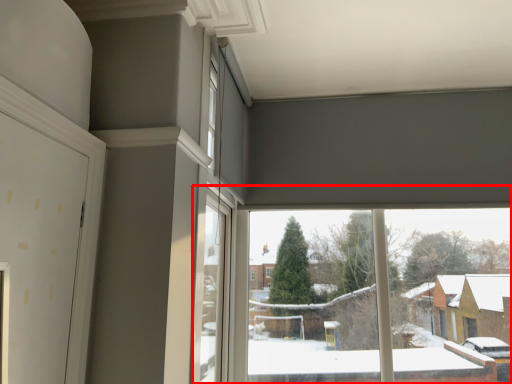
Question: In this image, where is window (annotated by the red box) located relative to window?

Choices:
 (A) right
 (B) left

Answer: (A)